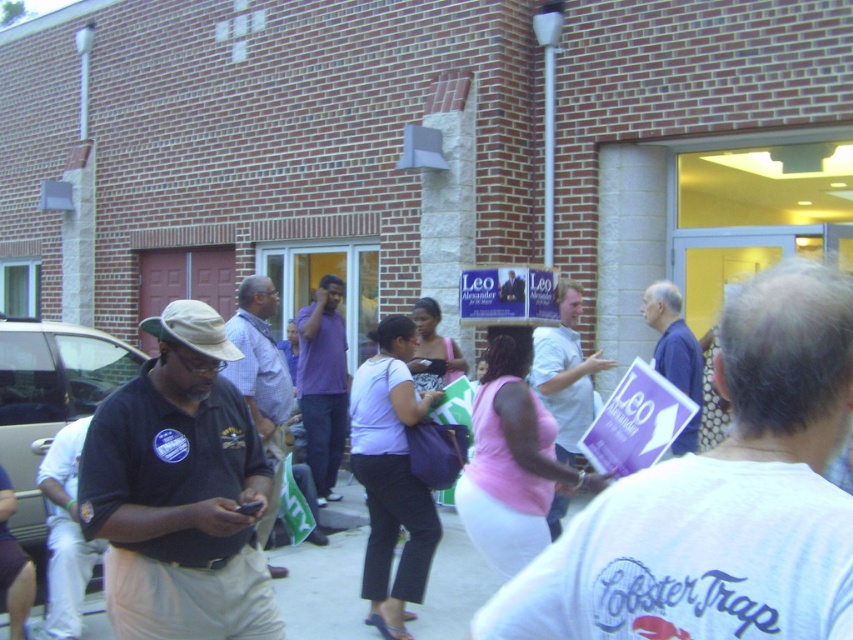
Does purple paper sign at center lie behind white cotton shirt at center?

No, purple paper sign at center is in front of white cotton shirt at center.

Which is in front, point (743, 561) or point (556, 529)?

Point (743, 561) is more forward.

This screenshot has width=853, height=640. Describe the element at coordinates (721, 499) in the screenshot. I see `purple paper sign at center` at that location.

Image resolution: width=853 pixels, height=640 pixels. In order to click on purple paper sign at center in this screenshot , I will do `click(721, 499)`.

Can you confirm if light brown shirt at center is thinner than purple paper at center?

Indeed, light brown shirt at center has a lesser width compared to purple paper at center.

Between point (280, 372) and point (675, 369), which one is positioned behind?

The point (280, 372) is more distant.

Which is behind, point (250, 305) or point (683, 378)?

The point (250, 305) is behind.

You are a GUI agent. You are given a task and a screenshot of the screen. Output one action in this format:
    pyautogui.click(x=<x>, y=<y>)
    Task: Click on the light brown shirt at center
    This screenshot has height=640, width=853.
    Given the screenshot: What is the action you would take?
    pyautogui.click(x=260, y=380)

Who is more distant from viewer, (154, 632) or (489, 323)?

The point (489, 323) is more distant.

Between dark blue polo shirt at left and blue paper sign at center, which one has less height?

With less height is blue paper sign at center.

Describe the element at coordinates (178, 492) in the screenshot. This screenshot has height=640, width=853. I see `dark blue polo shirt at left` at that location.

Where is `dark blue polo shirt at left`? This screenshot has height=640, width=853. dark blue polo shirt at left is located at coordinates (178, 492).